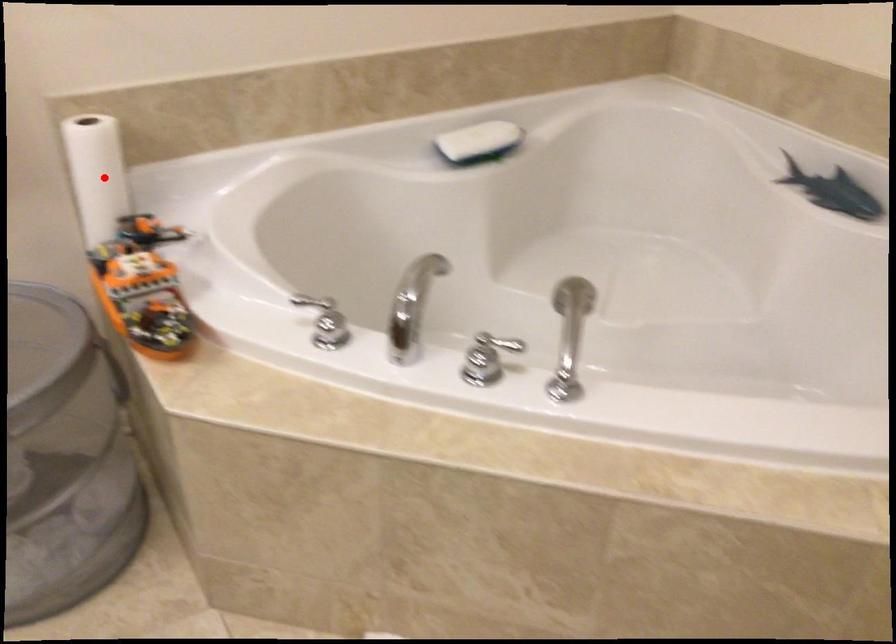
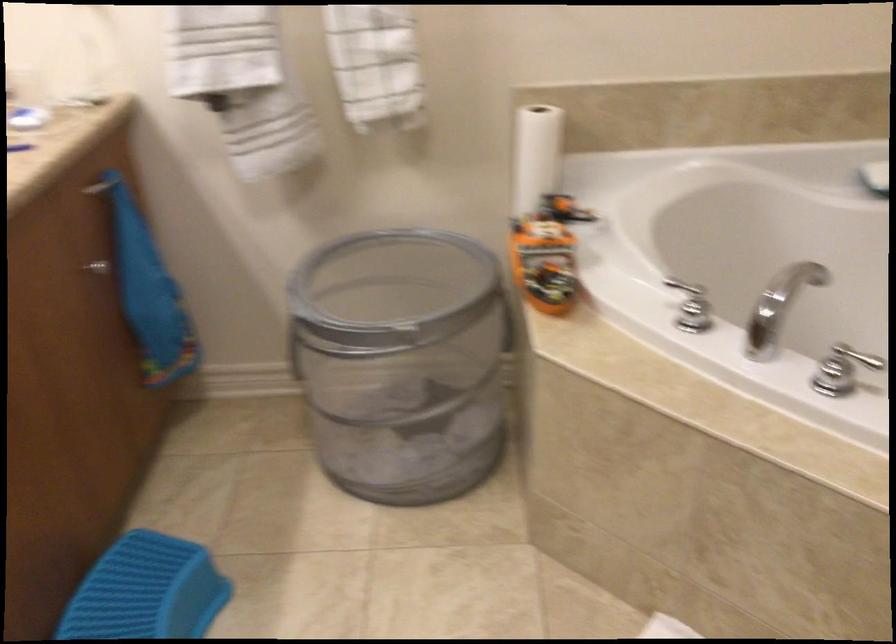
Question: I am providing you with two images of the same scene from different viewpoints. Given a red point in image1, look at the same physical point in image2. Is it:

Choices:
 (A) Closer to the viewpoint
 (B) Farther from the viewpoint

Answer: (B)